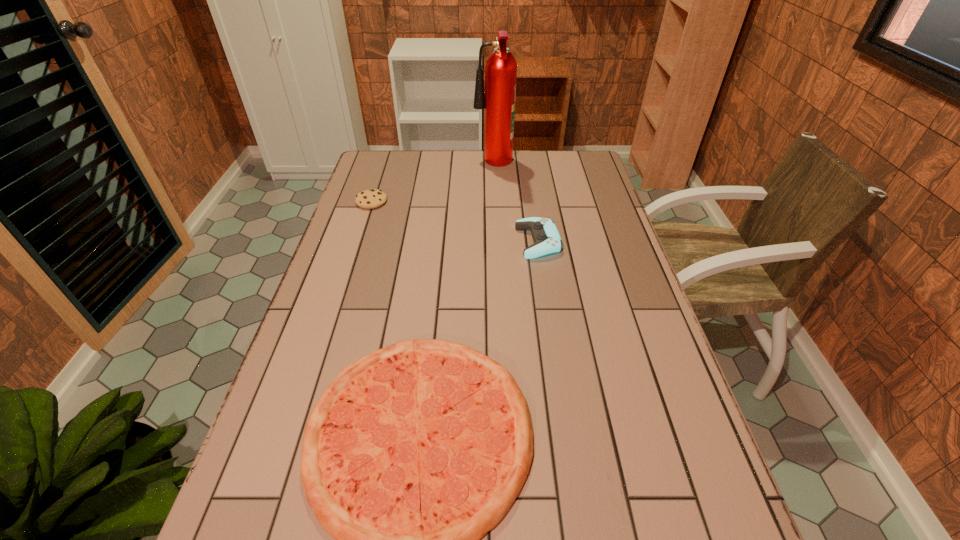
Choose which object is the third nearest neighbor to the control. Please provide its 2D coordinates. Your answer should be formatted as a tuple, i.e. [(x, y)], where the tuple contains the x and y coordinates of a point satisfying the conditions above.

[(372, 198)]

Locate an element on the screen. vacant area in the image that satisfies the following two spatial constraints: 1. at the nozzle of the tallest object; 2. on the left side of the control is located at coordinates (496, 241).

You are a GUI agent. You are given a task and a screenshot of the screen. Output one action in this format:
    pyautogui.click(x=<x>, y=<y>)
    Task: Click on the vacant region that satisfies the following two spatial constraints: 1. at the nozzle of the control; 2. on the right side of the tallest object
    The height and width of the screenshot is (540, 960).
    Given the screenshot: What is the action you would take?
    pyautogui.click(x=496, y=241)